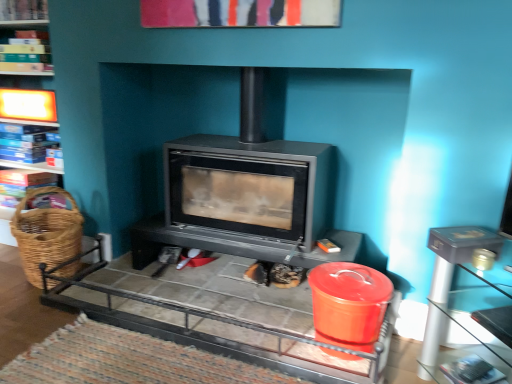
Where is `matte black fireplace at center, placed as the 2th table when sorted from right to left`? matte black fireplace at center, placed as the 2th table when sorted from right to left is located at coordinates (219, 317).

You are a GUI agent. You are given a task and a screenshot of the screen. Output one action in this format:
    pyautogui.click(x=<x>, y=<y>)
    Task: Click on the wooden bookshelf at upper left, which ranks as the 2th shelf in top-to-bottom order
    This screenshot has width=512, height=384.
    Given the screenshot: What is the action you would take?
    pyautogui.click(x=26, y=53)

This screenshot has height=384, width=512. What do you see at coordinates (23, 10) in the screenshot?
I see `wooden bookshelf at upper left, which is the third shelf in bottom-to-top order` at bounding box center [23, 10].

What do you see at coordinates (449, 281) in the screenshot? The width and height of the screenshot is (512, 384). I see `metallic gray table at right, arranged as the second table when viewed from the left` at bounding box center [449, 281].

What is the approximate height of metallic gray table at right, acting as the 1th table starting from the right?

23.05 inches.

This screenshot has width=512, height=384. What are the coordinates of `woven brown basket at left` in the screenshot? It's located at (46, 234).

Image resolution: width=512 pixels, height=384 pixels. I want to click on the 1st shelf behind the metallic gray table at right, arranged as the second table when viewed from the left, counting from the anchor's position, so click(23, 10).

Does metallic gray table at right, acting as the 1th table starting from the right, have a greater width compared to wooden bookshelf at upper left, the 1th shelf positioned from the top?

Correct, the width of metallic gray table at right, acting as the 1th table starting from the right, exceeds that of wooden bookshelf at upper left, the 1th shelf positioned from the top.

Is metallic gray table at right, acting as the 1th table starting from the right, not within wooden bookshelf at upper left, the 1th shelf positioned from the top?

Absolutely, metallic gray table at right, acting as the 1th table starting from the right, is external to wooden bookshelf at upper left, the 1th shelf positioned from the top.

Is metallic gray table at right, acting as the 1th table starting from the right, facing away from wooden bookshelf at upper left, which is the third shelf in bottom-to-top order?

metallic gray table at right, acting as the 1th table starting from the right, does not have its back to wooden bookshelf at upper left, which is the third shelf in bottom-to-top order.

Which object is wider, matte black fireplace at center, marked as the 1th table in a left-to-right arrangement, or wooden bookshelf at upper left, which is the second shelf in bottom-to-top order?

matte black fireplace at center, marked as the 1th table in a left-to-right arrangement.

In the scene shown: From a real-world perspective, is matte black fireplace at center, placed as the 2th table when sorted from right to left, physically above wooden bookshelf at upper left, which ranks as the 2th shelf in top-to-bottom order?

Incorrect, from a real-world perspective, matte black fireplace at center, placed as the 2th table when sorted from right to left, is lower than wooden bookshelf at upper left, which ranks as the 2th shelf in top-to-bottom order.

How different are the orientations of matte black fireplace at center, marked as the 1th table in a left-to-right arrangement, and wooden bookshelf at upper left, which is the second shelf in bottom-to-top order, in degrees?

5.84 degrees separate the facing orientations of matte black fireplace at center, marked as the 1th table in a left-to-right arrangement, and wooden bookshelf at upper left, which is the second shelf in bottom-to-top order.

From a real-world perspective, which shelf is the 1st one underneath the wooden bookshelf at upper left, which is the third shelf in bottom-to-top order? Please provide its 2D coordinates.

[(26, 53)]

Based on the photo, is wooden bookshelf at upper left, which is the second shelf in bottom-to-top order, completely or partially outside of wooden bookshelf at upper left, which is the third shelf in bottom-to-top order?

Yes.

Is wooden bookshelf at upper left, which ranks as the 2th shelf in top-to-bottom order, thinner than wooden bookshelf at upper left, which is the third shelf in bottom-to-top order?

No, wooden bookshelf at upper left, which ranks as the 2th shelf in top-to-bottom order, is not thinner than wooden bookshelf at upper left, which is the third shelf in bottom-to-top order.

Based on the photo, in terms of height, does matte black fireplace at center, marked as the 1th table in a left-to-right arrangement, look taller or shorter compared to blue cardboard boxes at left, which is the third shelf from top to bottom?

Clearly, matte black fireplace at center, marked as the 1th table in a left-to-right arrangement, is shorter compared to blue cardboard boxes at left, which is the third shelf from top to bottom.

Is matte black fireplace at center, placed as the 2th table when sorted from right to left, in contact with blue cardboard boxes at left, which is counted as the 1th shelf, starting from the bottom?

No, matte black fireplace at center, placed as the 2th table when sorted from right to left, is not in contact with blue cardboard boxes at left, which is counted as the 1th shelf, starting from the bottom.

Between matte black fireplace at center, marked as the 1th table in a left-to-right arrangement, and blue cardboard boxes at left, which is counted as the 1th shelf, starting from the bottom, which one is positioned behind?

Positioned behind is blue cardboard boxes at left, which is counted as the 1th shelf, starting from the bottom.

From a real-world perspective, who is located higher, matte black fireplace at center, placed as the 2th table when sorted from right to left, or blue cardboard boxes at left, which is counted as the 1th shelf, starting from the bottom?

blue cardboard boxes at left, which is counted as the 1th shelf, starting from the bottom, from a real-world perspective.

Is matte black fireplace at center, placed as the 2th table when sorted from right to left, at the back of wooden bookshelf at upper left, which is the third shelf in bottom-to-top order?

wooden bookshelf at upper left, which is the third shelf in bottom-to-top order, is not turned away from matte black fireplace at center, placed as the 2th table when sorted from right to left.

Which is in front, wooden bookshelf at upper left, which is the third shelf in bottom-to-top order, or matte black fireplace at center, placed as the 2th table when sorted from right to left?

matte black fireplace at center, placed as the 2th table when sorted from right to left, is in front.

Is point (25, 9) closer to viewer compared to point (310, 325)?

No, (25, 9) is further to viewer.

Is wooden bookshelf at upper left, which is the third shelf in bottom-to-top order, wider than matte black fireplace at center, placed as the 2th table when sorted from right to left?

No, wooden bookshelf at upper left, which is the third shelf in bottom-to-top order, is not wider than matte black fireplace at center, placed as the 2th table when sorted from right to left.

Is wooden bookshelf at upper left, the 1th shelf positioned from the top, in contact with blue cardboard boxes at left, which is the third shelf from top to bottom?

No.

Between wooden bookshelf at upper left, which is the third shelf in bottom-to-top order, and blue cardboard boxes at left, which is counted as the 1th shelf, starting from the bottom, which one has larger width?

wooden bookshelf at upper left, which is the third shelf in bottom-to-top order, is wider.

Based on the photo, from the image's perspective, which object appears higher, wooden bookshelf at upper left, which is the third shelf in bottom-to-top order, or blue cardboard boxes at left, which is the third shelf from top to bottom?

From the image's view, wooden bookshelf at upper left, which is the third shelf in bottom-to-top order, is above.

Looking at this image, between wooden bookshelf at upper left, which is the third shelf in bottom-to-top order, and blue cardboard boxes at left, which is the third shelf from top to bottom, which one has larger size?

blue cardboard boxes at left, which is the third shelf from top to bottom.

Consider the image. Can we say wooden bookshelf at upper left, which is the second shelf in bottom-to-top order, lies outside woven brown basket at left?

Yes.

Is wooden bookshelf at upper left, which is the second shelf in bottom-to-top order, closer to camera compared to woven brown basket at left?

No, wooden bookshelf at upper left, which is the second shelf in bottom-to-top order, is behind woven brown basket at left.

Is point (24, 66) closer or farther from the camera than point (54, 226)?

Point (24, 66) appears to be farther away from the viewer than point (54, 226).

Are wooden bookshelf at upper left, which ranks as the 2th shelf in top-to-bottom order, and woven brown basket at left far apart?

Yes, wooden bookshelf at upper left, which ranks as the 2th shelf in top-to-bottom order, and woven brown basket at left are located far from each other.

The image size is (512, 384). I want to click on the 3rd shelf above when counting from the metallic gray table at right, arranged as the second table when viewed from the left (from the image's perspective), so click(23, 10).

At what (x,y) coordinates should I click in order to perform the action: click on the 1st table below when counting from the wooden bookshelf at upper left, which is the second shelf in bottom-to-top order (from the image's perspective). Please return your answer as a coordinate pair (x, y). Looking at the image, I should click on (219, 317).

Which object lies nearer to the anchor point wooden bookshelf at upper left, which is the third shelf in bottom-to-top order, matte black fireplace at center, placed as the 2th table when sorted from right to left, or wooden bookshelf at upper left, which ranks as the 2th shelf in top-to-bottom order?

Based on the image, wooden bookshelf at upper left, which ranks as the 2th shelf in top-to-bottom order, appears to be nearer to wooden bookshelf at upper left, which is the third shelf in bottom-to-top order.

Based on their spatial positions, is wooden bookshelf at upper left, which is the second shelf in bottom-to-top order, or woven brown basket at left closer to blue cardboard boxes at left, which is the third shelf from top to bottom?

wooden bookshelf at upper left, which is the second shelf in bottom-to-top order, is positioned closer to the anchor blue cardboard boxes at left, which is the third shelf from top to bottom.

Estimate the real-world distances between objects in this image. Which object is further from wooden bookshelf at upper left, which is the second shelf in bottom-to-top order, matte black fireplace at center, placed as the 2th table when sorted from right to left, or blue cardboard boxes at left, which is counted as the 1th shelf, starting from the bottom?

matte black fireplace at center, placed as the 2th table when sorted from right to left, is further to wooden bookshelf at upper left, which is the second shelf in bottom-to-top order.

From the image, which object appears to be farther from wooden bookshelf at upper left, which is the third shelf in bottom-to-top order, woven brown basket at left or wooden bookshelf at upper left, which is the second shelf in bottom-to-top order?

woven brown basket at left is positioned further to the anchor wooden bookshelf at upper left, which is the third shelf in bottom-to-top order.

Based on their spatial positions, is woven brown basket at left or blue cardboard boxes at left, which is counted as the 1th shelf, starting from the bottom, further from wooden bookshelf at upper left, which is the third shelf in bottom-to-top order?

Among the two, woven brown basket at left is located further to wooden bookshelf at upper left, which is the third shelf in bottom-to-top order.

Estimate the real-world distances between objects in this image. Which object is further from woven brown basket at left, blue cardboard boxes at left, which is the third shelf from top to bottom, or metallic gray table at right, acting as the 1th table starting from the right?

Based on the image, metallic gray table at right, acting as the 1th table starting from the right, appears to be further to woven brown basket at left.

Looking at the image, which one is located further to wooden bookshelf at upper left, which ranks as the 2th shelf in top-to-bottom order, matte black fireplace at center, placed as the 2th table when sorted from right to left, or metallic gray table at right, arranged as the second table when viewed from the left?

metallic gray table at right, arranged as the second table when viewed from the left, lies further to wooden bookshelf at upper left, which ranks as the 2th shelf in top-to-bottom order, than the other object.

Based on their spatial positions, is wooden bookshelf at upper left, which ranks as the 2th shelf in top-to-bottom order, or blue cardboard boxes at left, which is counted as the 1th shelf, starting from the bottom, further from woven brown basket at left?

wooden bookshelf at upper left, which ranks as the 2th shelf in top-to-bottom order, lies further to woven brown basket at left than the other object.

Identify the location of shelf located between wooden bookshelf at upper left, the 1th shelf positioned from the top, and metallic gray table at right, arranged as the second table when viewed from the left, in the left-right direction. (26, 53).

Find the location of a particular element. basket between wooden bookshelf at upper left, the 1th shelf positioned from the top, and metallic gray table at right, acting as the 1th table starting from the right, from left to right is located at coordinates (46, 234).

The image size is (512, 384). Find the location of `basket between wooden bookshelf at upper left, which is the second shelf in bottom-to-top order, and metallic gray table at right, acting as the 1th table starting from the right, from left to right`. basket between wooden bookshelf at upper left, which is the second shelf in bottom-to-top order, and metallic gray table at right, acting as the 1th table starting from the right, from left to right is located at coordinates (46, 234).

Find the location of `table between wooden bookshelf at upper left, which ranks as the 2th shelf in top-to-bottom order, and metallic gray table at right, acting as the 1th table starting from the right, in the horizontal direction`. table between wooden bookshelf at upper left, which ranks as the 2th shelf in top-to-bottom order, and metallic gray table at right, acting as the 1th table starting from the right, in the horizontal direction is located at coordinates (219, 317).